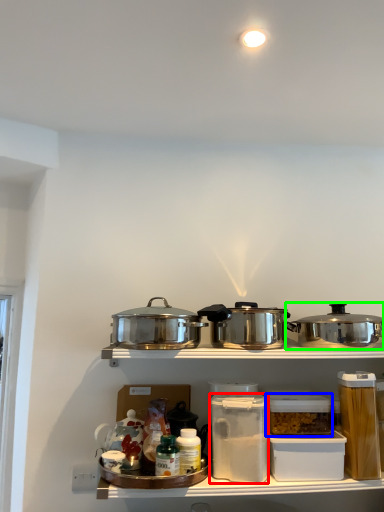
Question: Considering the real-world distances, which object is closest to appliance (highlighted by a red box)? appliance (highlighted by a blue box) or kitchen appliance (highlighted by a green box).

Choices:
 (A) appliance
 (B) kitchen appliance

Answer: (A)